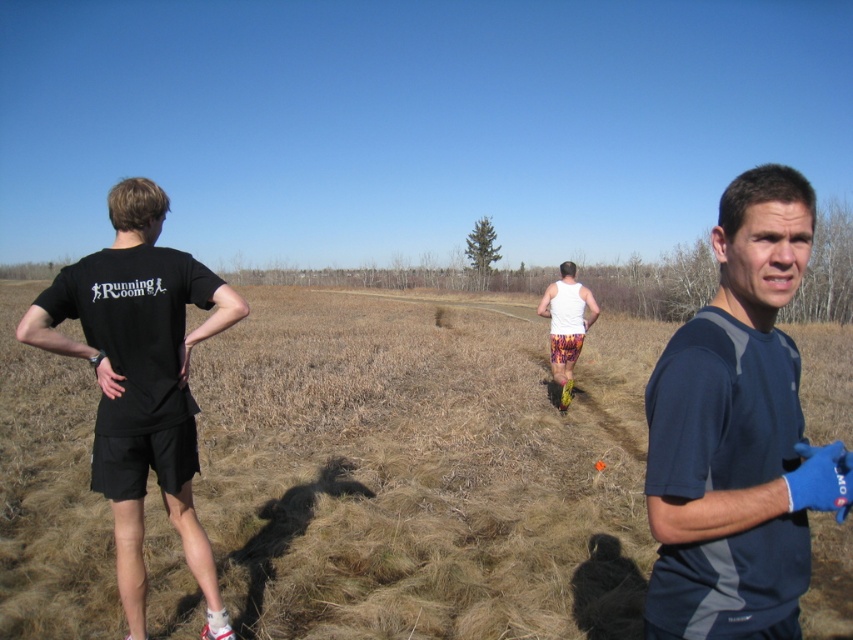
Question: Can you confirm if black cotton t-shirt at left is positioned to the left of white tank top at center?

Choices:
 (A) no
 (B) yes

Answer: (B)

Question: In this image, where is brown dry grass at center located relative to black cotton t-shirt at left?

Choices:
 (A) right
 (B) left

Answer: (A)

Question: Which point appears closest to the camera in this image?

Choices:
 (A) (132, 324)
 (B) (709, 339)
 (C) (553, 339)
 (D) (416, 477)

Answer: (B)

Question: Which point is closer to the camera taking this photo?

Choices:
 (A) (178, 264)
 (B) (248, 420)

Answer: (A)

Question: Is blue fabric shirt at center smaller than white tank top at center?

Choices:
 (A) yes
 (B) no

Answer: (B)

Question: Which point is farther to the camera?

Choices:
 (A) white tank top at center
 (B) brown dry grass at center
 (C) blue fabric shirt at center

Answer: (A)